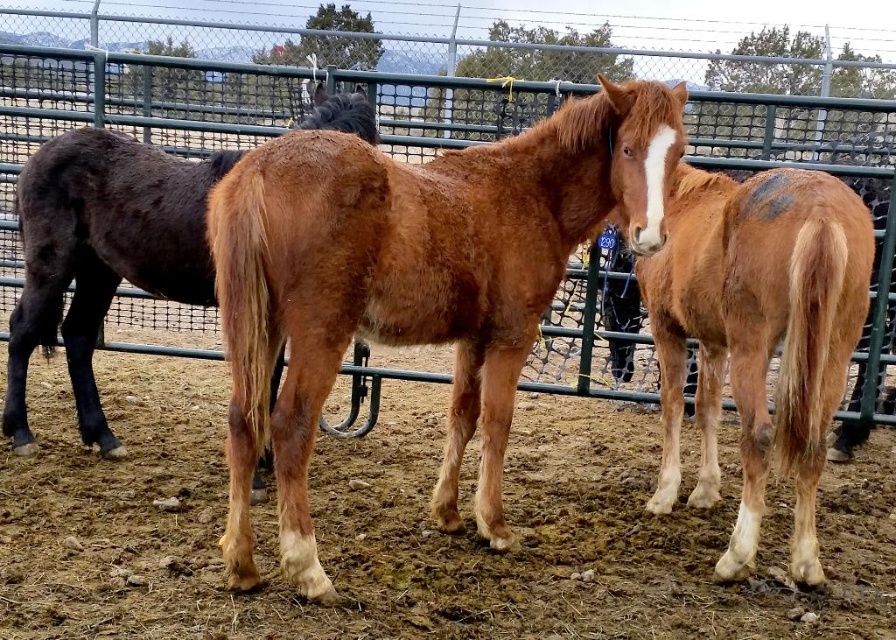
Does brown fuzzy horse at center appear on the right side of brown glossy horse at center?

Indeed, brown fuzzy horse at center is positioned on the right side of brown glossy horse at center.

Who is taller, brown fuzzy horse at center or brown glossy horse at center?

brown fuzzy horse at center

Describe the element at coordinates (412, 282) in the screenshot. This screenshot has height=640, width=896. I see `brown fuzzy horse at center` at that location.

Find the location of `brown fuzzy horse at center`. brown fuzzy horse at center is located at coordinates (412, 282).

Between point (622, 257) and point (748, 179), which one is positioned in front?

Point (748, 179) is more forward.

This screenshot has width=896, height=640. What do you see at coordinates (459, 113) in the screenshot?
I see `green metal fence at center` at bounding box center [459, 113].

Find the location of a particular element. The height and width of the screenshot is (640, 896). green metal fence at center is located at coordinates (459, 113).

Between brown soil at center and brown fuzzy horse at center, which one appears on the left side from the viewer's perspective?

brown soil at center is more to the left.

Does brown soil at center come in front of brown fuzzy horse at center?

No, it is behind brown fuzzy horse at center.

The width and height of the screenshot is (896, 640). Find the location of `brown soil at center`. brown soil at center is located at coordinates (411, 529).